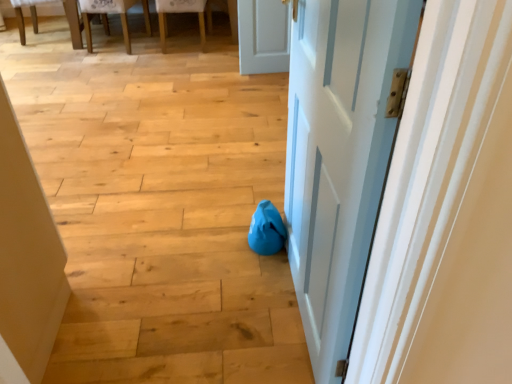
Question: Is wooden chair at upper left, the 1th chair from the right, situated inside wooden textured chair at upper left, the 2th chair viewed from the right, or outside?

Choices:
 (A) inside
 (B) outside

Answer: (B)

Question: From the image's perspective, is wooden chair at upper left, which ranks as the 2th chair in left-to-right order, positioned above or below wooden textured chair at upper left, the 2th chair viewed from the right?

Choices:
 (A) above
 (B) below

Answer: (B)

Question: Considering the real-world distances, which object is closest to the wooden textured chair at upper left, the 2th chair viewed from the right?

Choices:
 (A) blue fabric bean bag at center
 (B) wooden chair at upper left, the 1th chair from the right
 (C) white painted wood door at center

Answer: (B)

Question: Which is nearer to the wooden textured chair at upper left, the 2th chair viewed from the right?

Choices:
 (A) white painted wood door at center
 (B) wooden chair at upper left, the 1th chair from the right
 (C) blue fabric bean bag at center

Answer: (B)